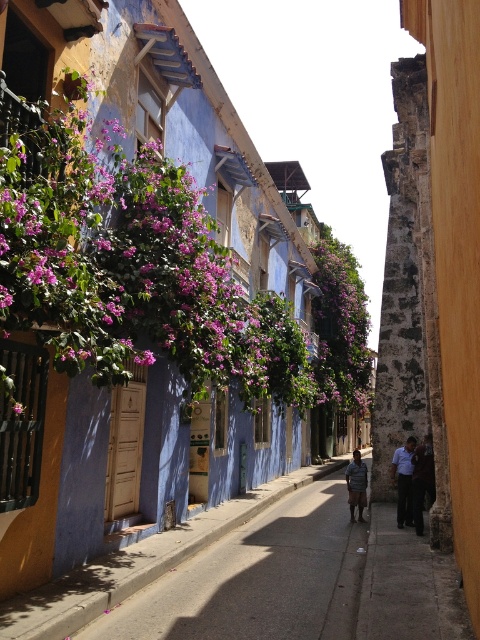
Is purple leafy plant at upper left wider than striped fabric shirt at center?

Correct, the width of purple leafy plant at upper left exceeds that of striped fabric shirt at center.

Between point (164, 212) and point (361, 518), which one is positioned behind?

The point (361, 518) is behind.

Measure the distance between purple leafy plant at upper left and camera.

purple leafy plant at upper left is 16.89 feet away from camera.

Locate an element on the screen. This screenshot has width=480, height=640. purple leafy plant at upper left is located at coordinates (143, 273).

Is point (208, 282) farther from camera compared to point (410, 442)?

That is False.

Can you confirm if purple leafy plant at upper left is thinner than blue shirt at center?

No, purple leafy plant at upper left is not thinner than blue shirt at center.

Find the location of `purple leafy plant at upper left`. purple leafy plant at upper left is located at coordinates (143, 273).

Where is `purple leafy plant at upper left`? This screenshot has width=480, height=640. purple leafy plant at upper left is located at coordinates (x=143, y=273).

Is smooth concrete pavement at center smaller than striped fabric shirt at center?

Actually, smooth concrete pavement at center might be larger than striped fabric shirt at center.

Is smooth concrete pavement at center bigger than striped fabric shirt at center?

Yes, smooth concrete pavement at center is bigger than striped fabric shirt at center.

Locate an element on the screen. smooth concrete pavement at center is located at coordinates (301, 580).

Where is `smooth concrete pavement at center`? smooth concrete pavement at center is located at coordinates (301, 580).